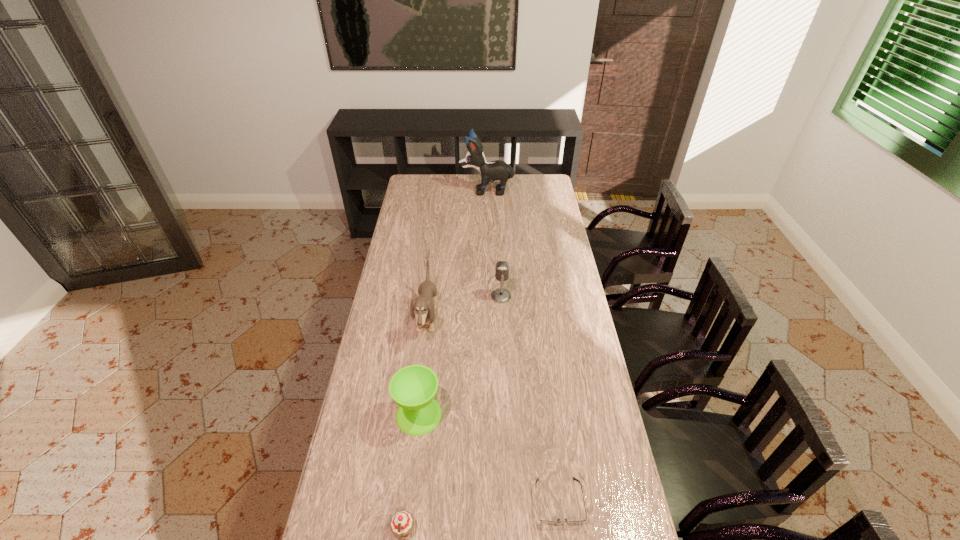
You are a GUI agent. You are given a task and a screenshot of the screen. Output one action in this format:
    pyautogui.click(x=<x>, y=<y>)
    Task: Click on the free space at the far right corner
    Image resolution: width=960 pixels, height=540 pixels.
    Given the screenshot: What is the action you would take?
    pyautogui.click(x=525, y=184)

Find the location of a particular element. This screenshot has width=960, height=540. vacant area that lies between the nearer puppy and the microphone is located at coordinates (464, 307).

At what (x,y) coordinates should I click in order to perform the action: click on unoccupied area between the microphone and the right puppy. Please return your answer as a coordinate pair (x, y). This screenshot has height=540, width=960. Looking at the image, I should click on (493, 244).

At what (x,y) coordinates should I click in order to perform the action: click on empty location between the microphone and the taller puppy. Please return your answer as a coordinate pair (x, y). Looking at the image, I should click on (493, 244).

This screenshot has width=960, height=540. What are the coordinates of `free spot between the microphone and the nearer puppy` in the screenshot? It's located at (464, 307).

Where is `free space that is in between the microphone and the spectacles`? Image resolution: width=960 pixels, height=540 pixels. free space that is in between the microphone and the spectacles is located at coordinates (530, 399).

Find the location of a particular element. The image size is (960, 540). free space between the nearer puppy and the microphone is located at coordinates (464, 307).

Locate an element on the screen. This screenshot has width=960, height=540. object that is the fifth closest to the shortest object is located at coordinates (495, 170).

Find the location of a particular element. The width and height of the screenshot is (960, 540). the third closest object relative to the spectacles is located at coordinates (423, 306).

Where is `free location that satisfies the following two spatial constraints: 1. on the front-facing side of the microphone; 2. on the right side of the farthest object`? This screenshot has height=540, width=960. free location that satisfies the following two spatial constraints: 1. on the front-facing side of the microphone; 2. on the right side of the farthest object is located at coordinates (489, 296).